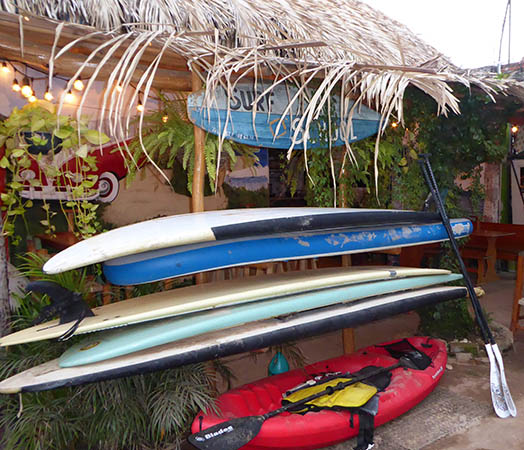
At what (x,y) coordinates should I click in order to perform the action: click on hanging lights. Please return your answer as a coordinate pair (x, y). The image size is (524, 450). Looking at the image, I should click on (24, 81), (394, 124), (515, 128).